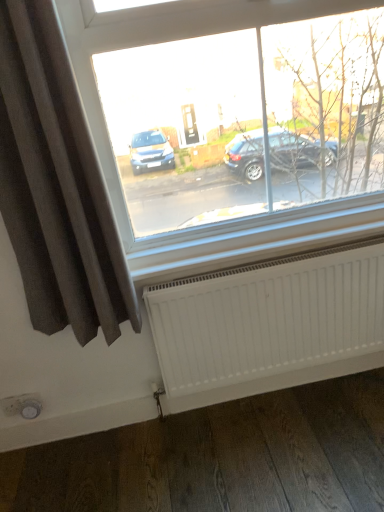
What do you see at coordinates (269, 317) in the screenshot?
I see `white matte radiator at lower center` at bounding box center [269, 317].

Find the location of `white matte radiator at lower center`. white matte radiator at lower center is located at coordinates (269, 317).

Measure the distance between point (x=367, y=293) and camera.

Point (x=367, y=293) is 1.65 meters from camera.

What is the approximate height of dark grey fabric curtain at left?

The height of dark grey fabric curtain at left is 3.63 feet.

Describe the element at coordinates (56, 185) in the screenshot. I see `dark grey fabric curtain at left` at that location.

Find the location of a particular element. dark grey fabric curtain at left is located at coordinates (56, 185).

At what (x,y) coordinates should I click in order to perform the action: click on white matte radiator at lower center. Please return your answer as a coordinate pair (x, y). The image size is (384, 512). Looking at the image, I should click on pos(269,317).

From the picture: Which is more to the left, white matte radiator at lower center or dark grey fabric curtain at left?

dark grey fabric curtain at left is more to the left.

Is white matte radiator at lower center positioned behind dark grey fabric curtain at left?

Yes, the depth of white matte radiator at lower center is greater than that of dark grey fabric curtain at left.

Which point is more forward, (301, 361) or (125, 279)?

Point (125, 279)

From the image's perspective, who appears lower, white matte radiator at lower center or dark grey fabric curtain at left?

white matte radiator at lower center appears lower in the image.

From a real-world perspective, who is located lower, white matte radiator at lower center or dark grey fabric curtain at left?

white matte radiator at lower center.

Is white matte radiator at lower center wider than dark grey fabric curtain at left?

No.

Considering the relative sizes of white matte radiator at lower center and dark grey fabric curtain at left in the image provided, is white matte radiator at lower center taller than dark grey fabric curtain at left?

No.

Is white matte radiator at lower center bigger than dark grey fabric curtain at left?

No, white matte radiator at lower center is not bigger than dark grey fabric curtain at left.

Is white matte radiator at lower center surrounding dark grey fabric curtain at left?

No.

Is white matte radiator at lower center far away from dark grey fabric curtain at left?

That's not correct — white matte radiator at lower center is a little close to dark grey fabric curtain at left.

Based on the photo, does white matte radiator at lower center turn towards dark grey fabric curtain at left?

No, white matte radiator at lower center is not turned towards dark grey fabric curtain at left.

Where is `curtain above the white matte radiator at lower center (from a real-world perspective)`? curtain above the white matte radiator at lower center (from a real-world perspective) is located at coordinates (56, 185).

Which is more to the left, dark grey fabric curtain at left or white matte radiator at lower center?

dark grey fabric curtain at left.

Which object is further away from the camera, dark grey fabric curtain at left or white matte radiator at lower center?

Positioned behind is white matte radiator at lower center.

Does point (137, 309) appear closer or farther from the camera than point (143, 296)?

Point (137, 309) is positioned closer to the camera compared to point (143, 296).

From the image's perspective, is dark grey fabric curtain at left beneath white matte radiator at lower center?

Incorrect, from the image's perspective, dark grey fabric curtain at left is higher than white matte radiator at lower center.

From a real-world perspective, is dark grey fabric curtain at left on white matte radiator at lower center?

Yes.

Which object is wider, dark grey fabric curtain at left or white matte radiator at lower center?

dark grey fabric curtain at left is wider.

Considering the sizes of objects dark grey fabric curtain at left and white matte radiator at lower center in the image provided, who is shorter, dark grey fabric curtain at left or white matte radiator at lower center?

With less height is white matte radiator at lower center.

Is dark grey fabric curtain at left bigger or smaller than white matte radiator at lower center?

In the image, dark grey fabric curtain at left appears to be larger than white matte radiator at lower center.

Is white matte radiator at lower center a part of dark grey fabric curtain at left?

No, white matte radiator at lower center is not inside dark grey fabric curtain at left.

Is dark grey fabric curtain at left not near white matte radiator at lower center?

Actually, dark grey fabric curtain at left and white matte radiator at lower center are a little close together.

Is dark grey fabric curtain at left aimed at white matte radiator at lower center?

No, dark grey fabric curtain at left is not aimed at white matte radiator at lower center.

Image resolution: width=384 pixels, height=512 pixels. I want to click on curtain above the white matte radiator at lower center (from a real-world perspective), so click(56, 185).

In order to click on curtain on the left side of white matte radiator at lower center in this screenshot , I will do `click(56, 185)`.

Identify the location of curtain in front of the white matte radiator at lower center. (56, 185).